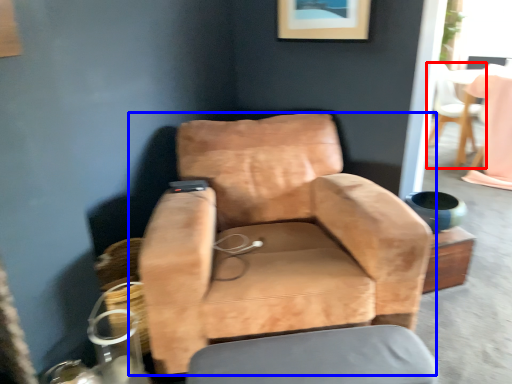
Question: Which object is further to the camera taking this photo, chair (highlighted by a red box) or chair (highlighted by a blue box)?

Choices:
 (A) chair
 (B) chair

Answer: (A)